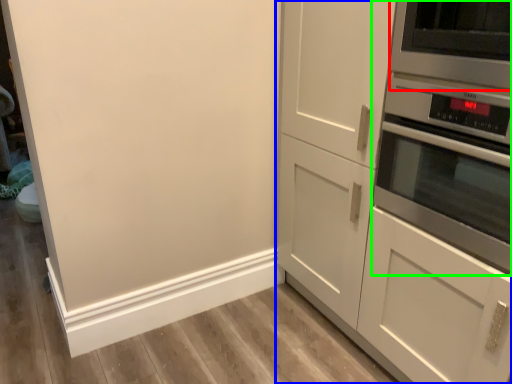
Question: Estimate the real-world distances between objects in this image. Which object is closer to appliance (highlighted by a red box), cabinetry (highlighted by a blue box) or home appliance (highlighted by a green box)?

Choices:
 (A) cabinetry
 (B) home appliance

Answer: (B)